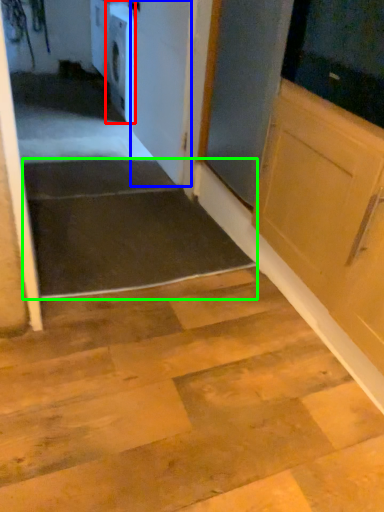
Question: Estimate the real-world distances between objects in this image. Which object is farther from dish washer (highlighted by a red box), door (highlighted by a blue box) or stairwell (highlighted by a green box)?

Choices:
 (A) door
 (B) stairwell

Answer: (B)